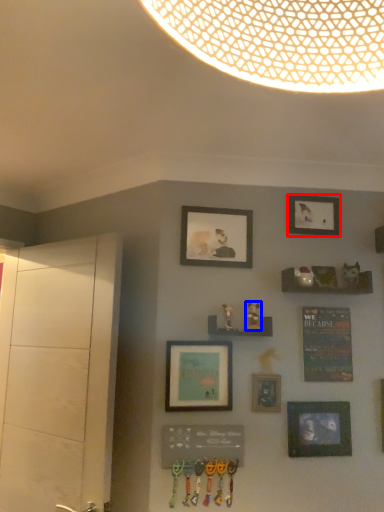
Question: Which object is closer to the camera taking this photo, picture frame (highlighted by a red box) or art (highlighted by a blue box)?

Choices:
 (A) picture frame
 (B) art

Answer: (B)